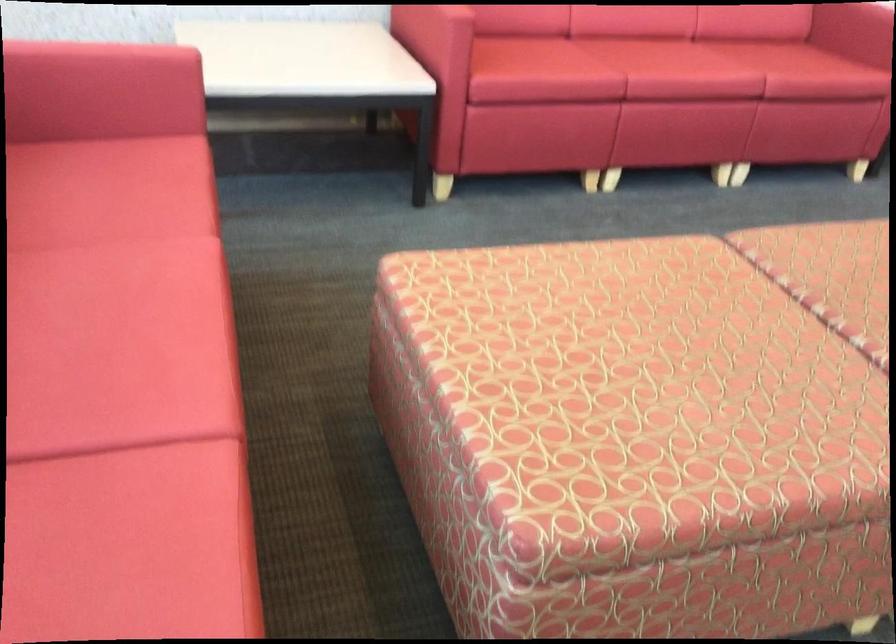
Locate an element on the screen. The height and width of the screenshot is (644, 896). patterned sofa sitting surface is located at coordinates (677, 62).